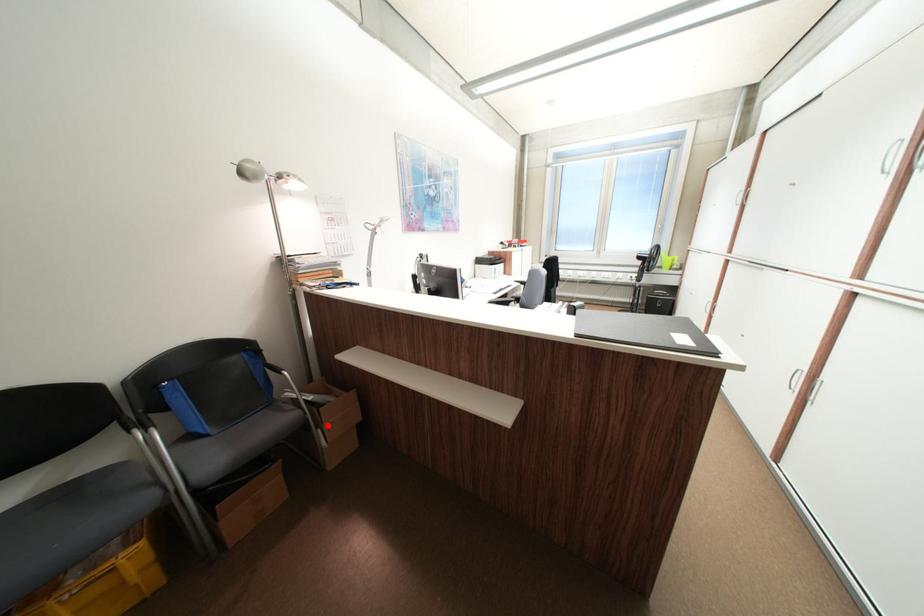
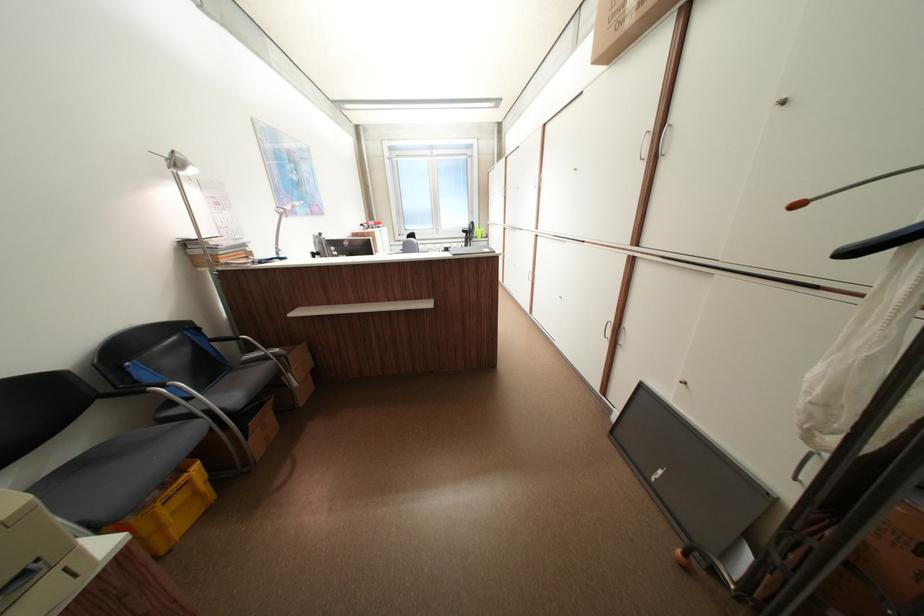
Question: A red point is marked in image1. In image2, is the corresponding 3D point closer to the camera or farther? Reply with the corresponding letter.

Choices:
 (A) The corresponding 3D point is closer.
 (B) The corresponding 3D point is farther.

Answer: (A)